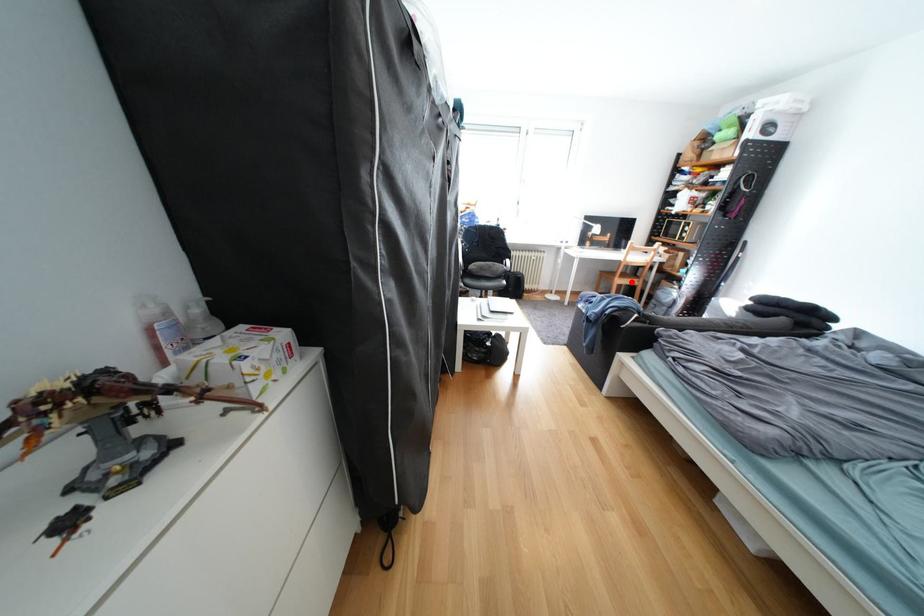
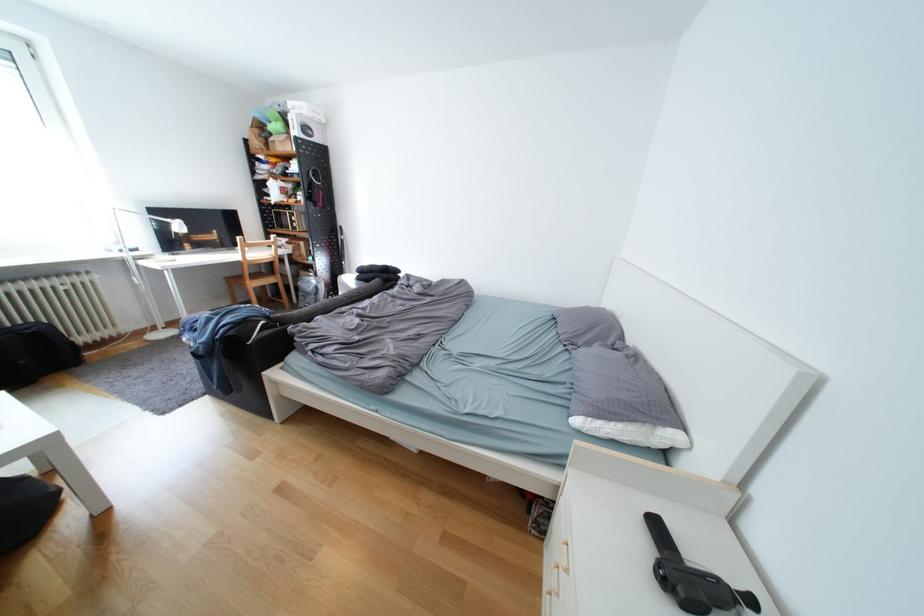
Find the pixel in the second image that matches the highlighted location in the first image.

(265, 285)